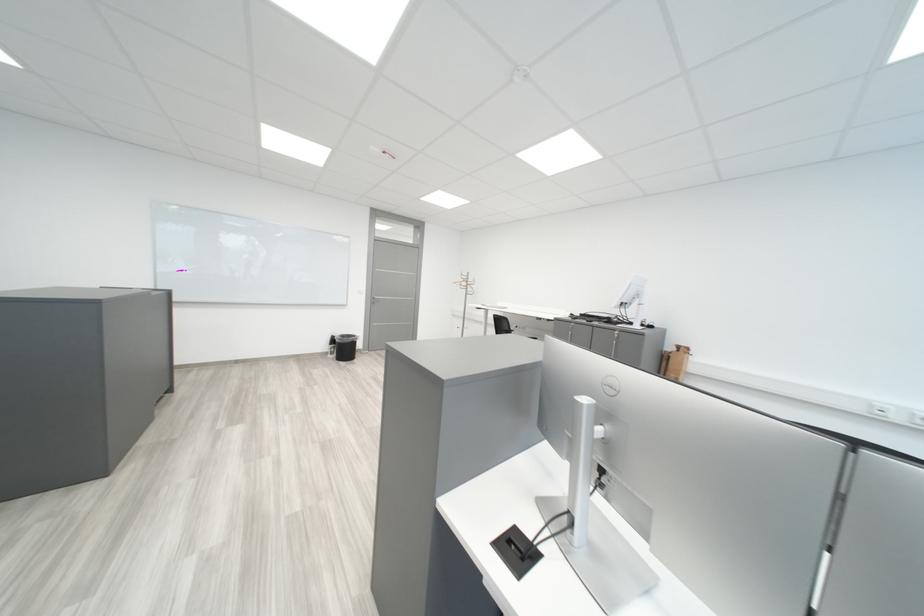
At what (x,y) coordinates should I click in order to perform the action: click on brown cardboard box. Please return your answer as a coordinate pair (x, y). Image resolution: width=924 pixels, height=616 pixels. Looking at the image, I should click on (675, 362).